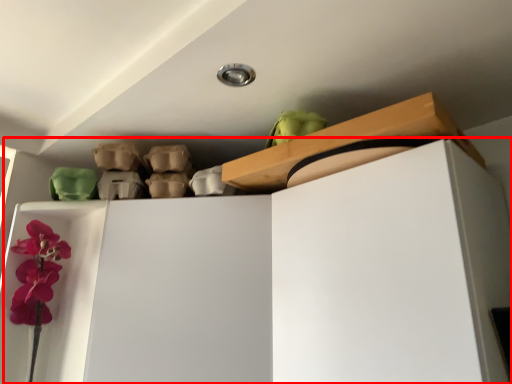
Question: From the image's perspective, considering the relative positions of dresser (annotated by the red box) and shelf in the image provided, where is dresser (annotated by the red box) located with respect to the staircase?

Choices:
 (A) above
 (B) below

Answer: (B)